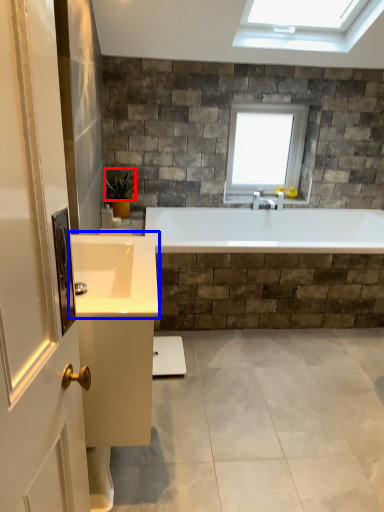
Question: Which object appears closest to the camera in this image, plant (highlighted by a red box) or sink (highlighted by a blue box)?

Choices:
 (A) plant
 (B) sink

Answer: (B)